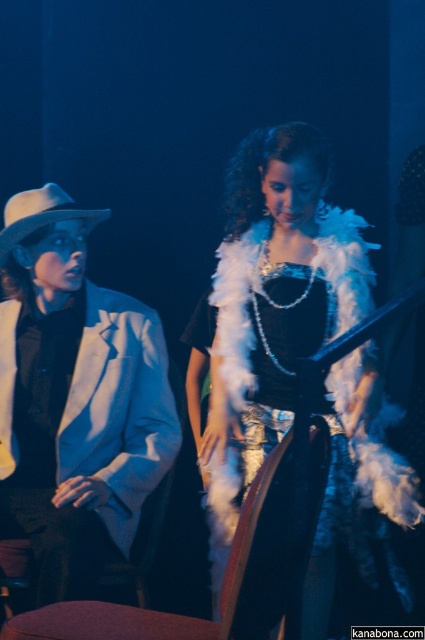
Is white fluffy dress at center behind white matte jacket at left?

No.

Is white fluffy dress at center bigger than white matte jacket at left?

Yes.

This screenshot has height=640, width=425. Identify the location of white fluffy dress at center. (272, 307).

This screenshot has width=425, height=640. What are the coordinates of `white fluffy dress at center` in the screenshot? It's located at (272, 307).

Is white fluffy dress at center wider than velvet cushioned chair at center?

Incorrect, white fluffy dress at center's width does not surpass velvet cushioned chair at center's.

Does point (337, 508) come closer to viewer compared to point (286, 611)?

That is False.

Describe the element at coordinates (272, 307) in the screenshot. I see `white fluffy dress at center` at that location.

Locate an element on the screen. The width and height of the screenshot is (425, 640). white fluffy dress at center is located at coordinates (272, 307).

Is velvet cushioned chair at center shorter than white felt cowboy hat at left?

No.

Which is more to the right, velvet cushioned chair at center or white felt cowboy hat at left?

From the viewer's perspective, velvet cushioned chair at center appears more on the right side.

Which is behind, point (263, 564) or point (17, 202)?

The point (17, 202) is behind.

You are a GUI agent. You are given a task and a screenshot of the screen. Output one action in this format:
    pyautogui.click(x=<x>, y=<y>)
    Task: Click on the velvet cushioned chair at center
    The height and width of the screenshot is (640, 425).
    Given the screenshot: What is the action you would take?
    pyautogui.click(x=226, y=563)